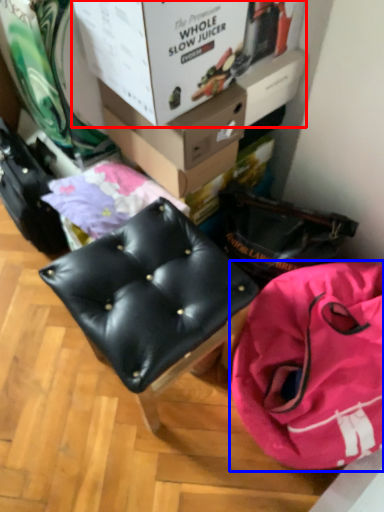
Question: Which object appears closest to the camera in this image, box (highlighted by a red box) or handbag (highlighted by a blue box)?

Choices:
 (A) box
 (B) handbag

Answer: (B)